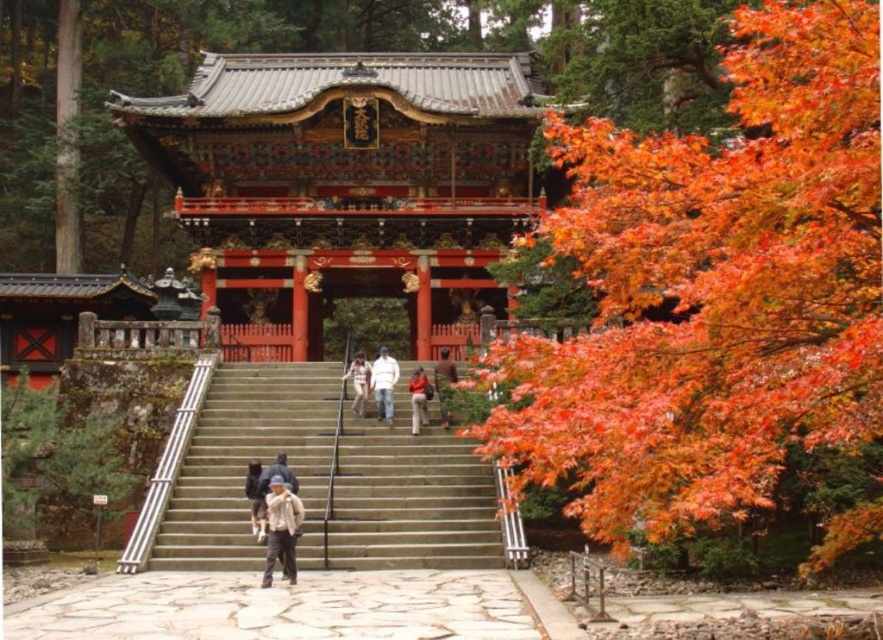
Question: Does stone stairs at center appear over light beige fabric jacket at lower center?

Choices:
 (A) no
 (B) yes

Answer: (B)

Question: Among these objects, which one is farthest from the camera?

Choices:
 (A) vivid orange leaves at right
 (B) stone stairs at center
 (C) light brown leather jacket at center

Answer: (C)

Question: Estimate the real-world distances between objects in this image. Which object is closer to the stone stairs at center?

Choices:
 (A) light brown leather jacket at center
 (B) dark gray fabric jacket at center
 (C) light beige fabric jacket at lower center
 (D) orange fabric jacket at center

Answer: (B)

Question: Is stone stairs at center above white matte jacket at center?

Choices:
 (A) no
 (B) yes

Answer: (A)

Question: Does dark brown leather jacket at center appear on the left side of orange fabric jacket at center?

Choices:
 (A) yes
 (B) no

Answer: (B)

Question: Which point is farther from the camera taking this photo?

Choices:
 (A) (714, 371)
 (B) (429, 387)
 (C) (361, 413)

Answer: (B)